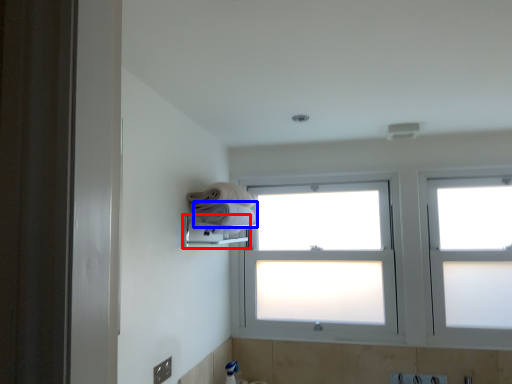
Question: Which point is further to the camera, towel bar (highlighted by a red box) or towel (highlighted by a blue box)?

Choices:
 (A) towel bar
 (B) towel

Answer: (B)